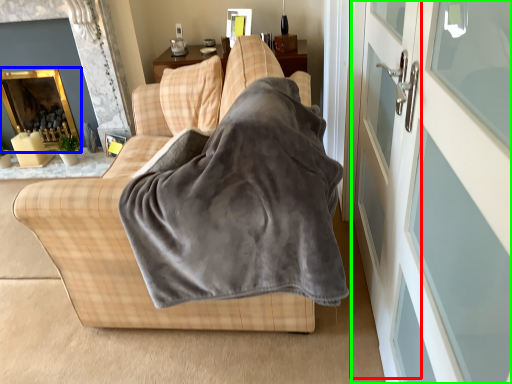
Question: Which object is the closest to the screen door (highlighted by a red box)? Choose among these: fireplace (highlighted by a blue box) or screen door (highlighted by a green box).

Choices:
 (A) fireplace
 (B) screen door

Answer: (B)